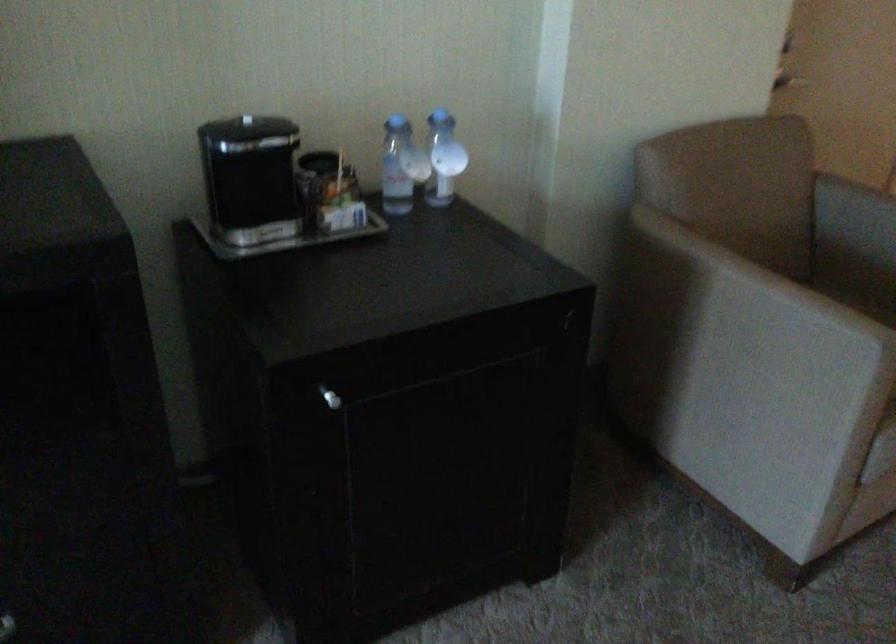
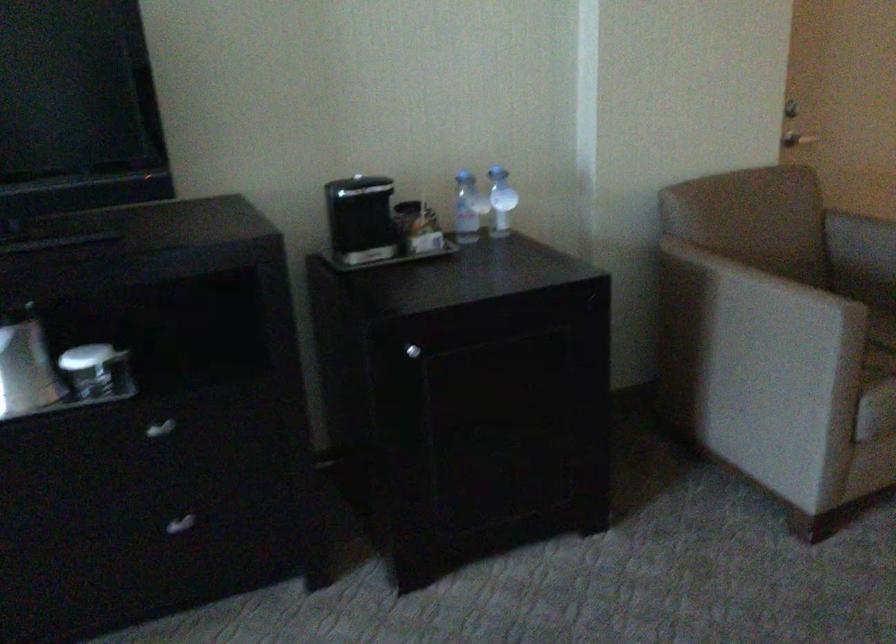
Question: The first image is from the beginning of the video and the second image is from the end. How did the camera likely rotate when shooting the video?

Choices:
 (A) Left
 (B) Right
 (C) Up
 (D) Down

Answer: (A)